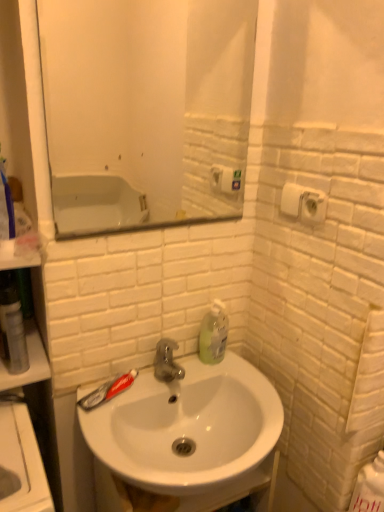
Measure the distance between point (182, 181) and camera.

Point (182, 181) is 1.58 meters from camera.

Measure the distance between transparent plastic mouthwash at left and camera.

transparent plastic mouthwash at left is 37.13 inches from camera.

At what (x,y) coordinates should I click in order to perform the action: click on translucent plastic toothpaste at sink left. Please return your answer as a coordinate pair (x, y). Image resolution: width=384 pixels, height=512 pixels. Looking at the image, I should click on (107, 391).

Locate an element on the screen. white matte toilet paper at upper right is located at coordinates (303, 203).

From the image's perspective, is translucent plastic toothpaste at sink left under white glossy mirror at upper center?

Indeed, from the image's perspective, translucent plastic toothpaste at sink left is shown beneath white glossy mirror at upper center.

Is translucent plastic toothpaste at sink left facing towards white glossy mirror at upper center?

No, translucent plastic toothpaste at sink left is not turned towards white glossy mirror at upper center.

From a real-world perspective, is translucent plastic toothpaste at sink left below white glossy mirror at upper center?

Yes, from a real-world perspective, translucent plastic toothpaste at sink left is below white glossy mirror at upper center.

Does point (224, 327) come closer to viewer compared to point (136, 478)?

No, (224, 327) is behind (136, 478).

Which is behind, translucent plastic soap dispenser at upper right or white glossy sink at center?

translucent plastic soap dispenser at upper right.

Between translucent plastic soap dispenser at upper right and white glossy sink at center, which one has smaller size?

Smaller between the two is translucent plastic soap dispenser at upper right.

In the scene shown: Considering the relative sizes of translucent plastic soap dispenser at upper right and white glossy sink at center in the image provided, is translucent plastic soap dispenser at upper right wider than white glossy sink at center?

In fact, translucent plastic soap dispenser at upper right might be narrower than white glossy sink at center.

Between white glossy mirror at upper center and white glossy sink at center, which one has larger width?

Wider between the two is white glossy sink at center.

From a real-world perspective, relative to white glossy sink at center, is white glossy mirror at upper center vertically above or below?

white glossy mirror at upper center is above white glossy sink at center.

From the image's perspective, is white glossy mirror at upper center positioned above or below white glossy sink at center?

white glossy mirror at upper center is above white glossy sink at center.

Which object is positioned more to the right, translucent plastic soap dispenser at upper right or translucent plastic toothpaste at sink left?

translucent plastic soap dispenser at upper right is more to the right.

Is translucent plastic soap dispenser at upper right inside or outside of translucent plastic toothpaste at sink left?

translucent plastic soap dispenser at upper right lies outside translucent plastic toothpaste at sink left.

From the image's perspective, is translucent plastic soap dispenser at upper right above or below translucent plastic toothpaste at sink left?

translucent plastic soap dispenser at upper right is situated higher than translucent plastic toothpaste at sink left in the image.

Between translucent plastic soap dispenser at upper right and translucent plastic toothpaste at sink left, which one has less height?

Standing shorter between the two is translucent plastic toothpaste at sink left.

Considering the sizes of objects translucent plastic soap dispenser at upper right and transparent plastic mouthwash at left in the image provided, who is thinner, translucent plastic soap dispenser at upper right or transparent plastic mouthwash at left?

Thinner between the two is translucent plastic soap dispenser at upper right.

Which of these two, translucent plastic soap dispenser at upper right or transparent plastic mouthwash at left, is bigger?

With larger size is transparent plastic mouthwash at left.

The height and width of the screenshot is (512, 384). In order to click on soap dispenser on the right of transparent plastic mouthwash at left in this screenshot , I will do (x=214, y=333).

Does point (224, 354) come farther from viewer compared to point (16, 356)?

Yes, it is behind point (16, 356).

Considering the relative positions of white matte toilet paper at upper right and white glossy mirror at upper center in the image provided, is white matte toilet paper at upper right to the left or to the right of white glossy mirror at upper center?

From the image, it's evident that white matte toilet paper at upper right is to the right of white glossy mirror at upper center.

Does white matte toilet paper at upper right have a greater width compared to white glossy mirror at upper center?

Yes, white matte toilet paper at upper right is wider than white glossy mirror at upper center.

This screenshot has height=512, width=384. Find the location of `toilet paper below the white glossy mirror at upper center (from the image's perspective)`. toilet paper below the white glossy mirror at upper center (from the image's perspective) is located at coordinates (303, 203).

Could you tell me if white matte toilet paper at upper right is turned towards white glossy mirror at upper center?

No.

Would you say transparent plastic mouthwash at left is to the left or to the right of translucent plastic soap dispenser at upper right in the picture?

Based on their positions, transparent plastic mouthwash at left is located to the left of translucent plastic soap dispenser at upper right.

Which point is more forward, (7,366) or (226,323)?

Point (7,366)

Which object is further away from the camera taking this photo, transparent plastic mouthwash at left or translucent plastic soap dispenser at upper right?

translucent plastic soap dispenser at upper right is further from the camera.

Is transparent plastic mouthwash at left positioned with its back to translucent plastic soap dispenser at upper right?

No.

The height and width of the screenshot is (512, 384). Find the location of `toothpaste below the white glossy mirror at upper center (from the image's perspective)`. toothpaste below the white glossy mirror at upper center (from the image's perspective) is located at coordinates (107, 391).

Find the location of `soap dispenser above the white glossy sink at center (from a real-world perspective)`. soap dispenser above the white glossy sink at center (from a real-world perspective) is located at coordinates (214, 333).

Which object lies further to the anchor point translucent plastic soap dispenser at upper right, transparent plastic mouthwash at left or translucent plastic toothpaste at sink left?

Among the two, transparent plastic mouthwash at left is located further to translucent plastic soap dispenser at upper right.

Looking at the image, which one is located further to translucent plastic soap dispenser at upper right, white glossy mirror at upper center or transparent plastic mouthwash at left?

Based on the image, white glossy mirror at upper center appears to be further to translucent plastic soap dispenser at upper right.

Looking at the image, which one is located further to transparent plastic mouthwash at left, white glossy mirror at upper center or white glossy sink at center?

white glossy mirror at upper center.

Which object lies nearer to the anchor point transparent plastic mouthwash at left, translucent plastic soap dispenser at upper right or white matte toilet paper at upper right?

Based on the image, translucent plastic soap dispenser at upper right appears to be nearer to transparent plastic mouthwash at left.

When comparing their distances from transparent plastic mouthwash at left, does translucent plastic soap dispenser at upper right or white glossy sink at center seem further?

translucent plastic soap dispenser at upper right is positioned further to the anchor transparent plastic mouthwash at left.

When comparing their distances from translucent plastic toothpaste at sink left, does white glossy sink at center or white matte toilet paper at upper right seem further?

white matte toilet paper at upper right is further to translucent plastic toothpaste at sink left.

From the image, which object appears to be nearer to white glossy sink at center, translucent plastic soap dispenser at upper right or white matte toilet paper at upper right?

translucent plastic soap dispenser at upper right.

Considering their positions, is white matte toilet paper at upper right positioned further to translucent plastic soap dispenser at upper right than white glossy mirror at upper center?

white glossy mirror at upper center is positioned further to the anchor translucent plastic soap dispenser at upper right.

Identify the location of soap dispenser that lies between white glossy mirror at upper center and translucent plastic toothpaste at sink left from top to bottom. (214, 333).

The height and width of the screenshot is (512, 384). I want to click on sink situated between transparent plastic mouthwash at left and white matte toilet paper at upper right from left to right, so click(x=187, y=426).

Locate an element on the screen. The image size is (384, 512). mirror between transparent plastic mouthwash at left and white matte toilet paper at upper right is located at coordinates (146, 110).

This screenshot has width=384, height=512. Identify the location of soap dispenser between transparent plastic mouthwash at left and white matte toilet paper at upper right in the horizontal direction. (214, 333).